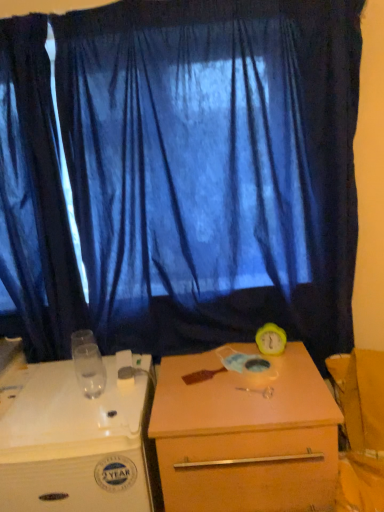
Question: Does blue fabric curtain at center, the second curtain when ordered from left to right, have a lesser height compared to white plastic desk at lower left, the second desk positioned from the right?

Choices:
 (A) no
 (B) yes

Answer: (A)

Question: From the image's perspective, would you say blue fabric curtain at center, the second curtain when ordered from left to right, is positioned over white plastic desk at lower left, the second desk positioned from the right?

Choices:
 (A) yes
 (B) no

Answer: (A)

Question: Can you confirm if blue fabric curtain at center, positioned as the 1th curtain in right-to-left order, is positioned to the right of white plastic desk at lower left, the 1th desk in the left-to-right sequence?

Choices:
 (A) yes
 (B) no

Answer: (A)

Question: Is blue fabric curtain at center, positioned as the 1th curtain in right-to-left order, positioned with its back to white plastic desk at lower left, the second desk positioned from the right?

Choices:
 (A) no
 (B) yes

Answer: (A)

Question: Is blue fabric curtain at center, positioned as the 1th curtain in right-to-left order, outside white plastic desk at lower left, the 1th desk in the left-to-right sequence?

Choices:
 (A) no
 (B) yes

Answer: (B)

Question: In terms of width, does matte wooden desk at center, the second desk positioned from the left, look wider or thinner when compared to blue fabric curtain at center, the second curtain when ordered from left to right?

Choices:
 (A) thin
 (B) wide

Answer: (B)

Question: Is matte wooden desk at center, the second desk positioned from the left, in front of or behind blue fabric curtain at center, positioned as the 1th curtain in right-to-left order, in the image?

Choices:
 (A) behind
 (B) front

Answer: (B)

Question: Considering the positions of matte wooden desk at center, the second desk positioned from the left, and blue fabric curtain at center, the second curtain when ordered from left to right, in the image, is matte wooden desk at center, the second desk positioned from the left, taller or shorter than blue fabric curtain at center, the second curtain when ordered from left to right,?

Choices:
 (A) short
 (B) tall

Answer: (A)

Question: Do you think matte wooden desk at center, placed as the first desk when sorted from right to left, is within blue fabric curtain at center, the second curtain when ordered from left to right, or outside of it?

Choices:
 (A) outside
 (B) inside

Answer: (A)

Question: Is white plastic desk at lower left, the second desk positioned from the right, inside the boundaries of matte wooden desk at center, placed as the first desk when sorted from right to left, or outside?

Choices:
 (A) outside
 (B) inside

Answer: (A)

Question: Visually, is white plastic desk at lower left, the 1th desk in the left-to-right sequence, positioned to the left or to the right of matte wooden desk at center, the second desk positioned from the left?

Choices:
 (A) right
 (B) left

Answer: (B)

Question: In the image, is white plastic desk at lower left, the 1th desk in the left-to-right sequence, positioned in front of or behind matte wooden desk at center, placed as the first desk when sorted from right to left?

Choices:
 (A) front
 (B) behind

Answer: (A)

Question: From a real-world perspective, is white plastic desk at lower left, the 1th desk in the left-to-right sequence, above or below matte wooden desk at center, placed as the first desk when sorted from right to left?

Choices:
 (A) below
 (B) above

Answer: (B)

Question: Choose the correct answer: Is blue fabric curtain at center, the second curtain when ordered from left to right, inside white plastic desk at lower left, the second desk positioned from the right, or outside it?

Choices:
 (A) outside
 (B) inside

Answer: (A)

Question: Is blue fabric curtain at center, the second curtain when ordered from left to right, bigger or smaller than white plastic desk at lower left, the 1th desk in the left-to-right sequence?

Choices:
 (A) big
 (B) small

Answer: (A)